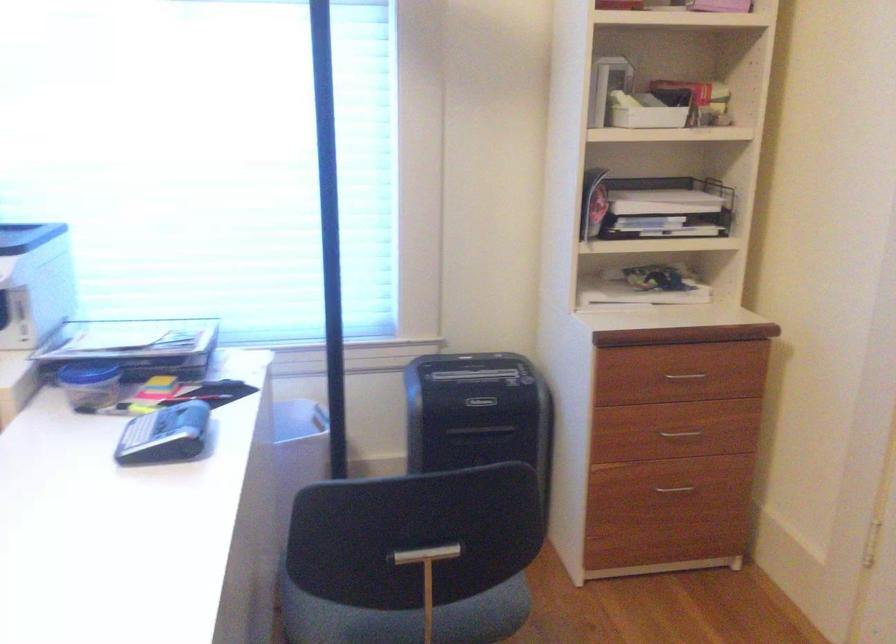
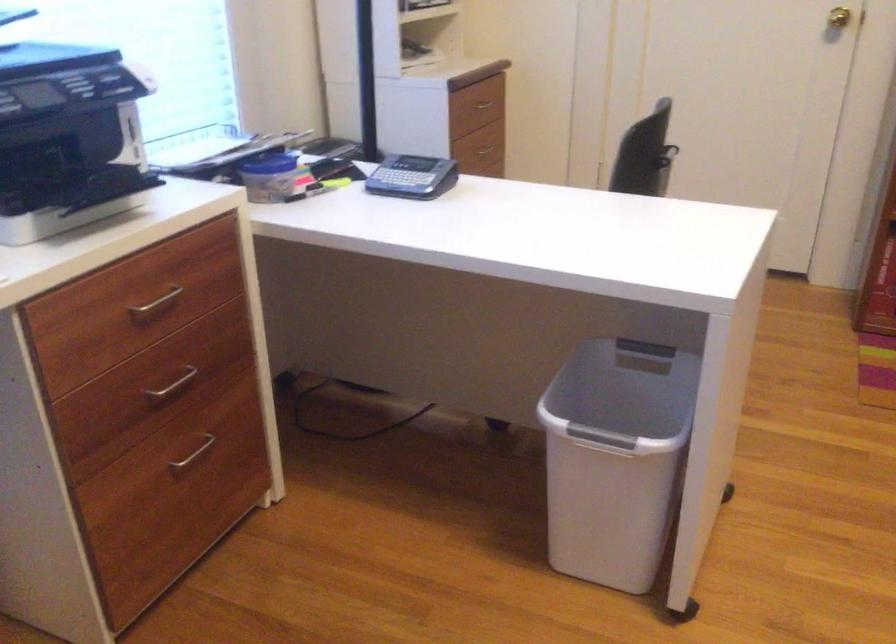
In the second image, find the point that corresponds to pixel 693 375 in the first image.

(484, 104)